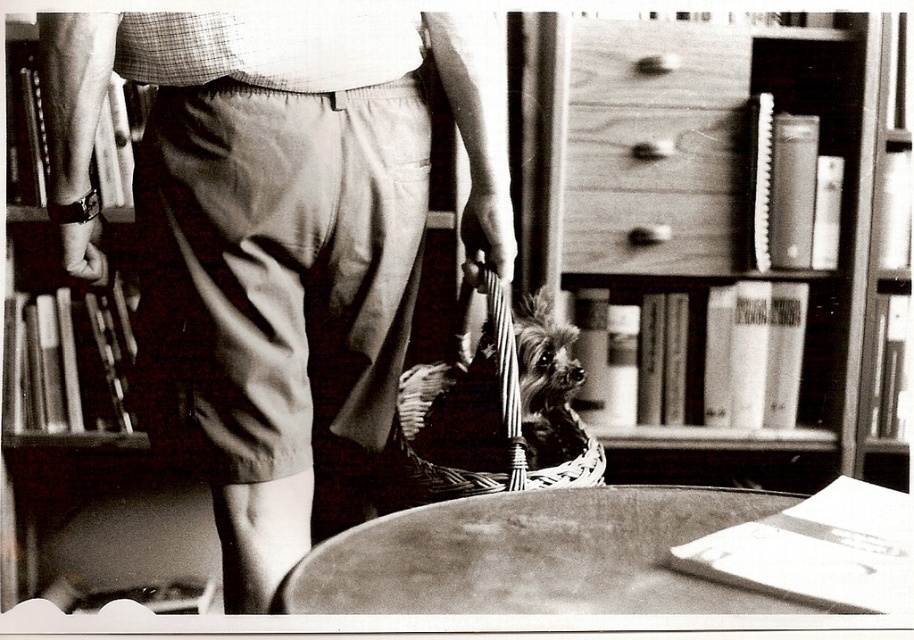
Question: Which point is closer to the camera?

Choices:
 (A) matte khaki shorts at center
 (B) wooden drawer at upper center
 (C) smooth wooden table at center
 (D) fuzzy brown dog at center

Answer: (C)

Question: Does wooden drawer at upper center have a greater width compared to fuzzy brown dog at center?

Choices:
 (A) yes
 (B) no

Answer: (A)

Question: Which object is farther from the camera taking this photo?

Choices:
 (A) matte khaki shorts at center
 (B) wooden drawer at upper center
 (C) smooth wooden table at center
 (D) smooth wood bookshelf at left

Answer: (B)

Question: Is matte khaki shorts at center to the right of fuzzy brown dog at center from the viewer's perspective?

Choices:
 (A) yes
 (B) no

Answer: (B)

Question: Can you confirm if wooden bookshelf at upper center is positioned below woven straw basket at center?

Choices:
 (A) no
 (B) yes

Answer: (A)

Question: Which point appears closest to the camera in this image?

Choices:
 (A) (527, 308)
 (B) (450, 104)
 (C) (708, 529)

Answer: (C)